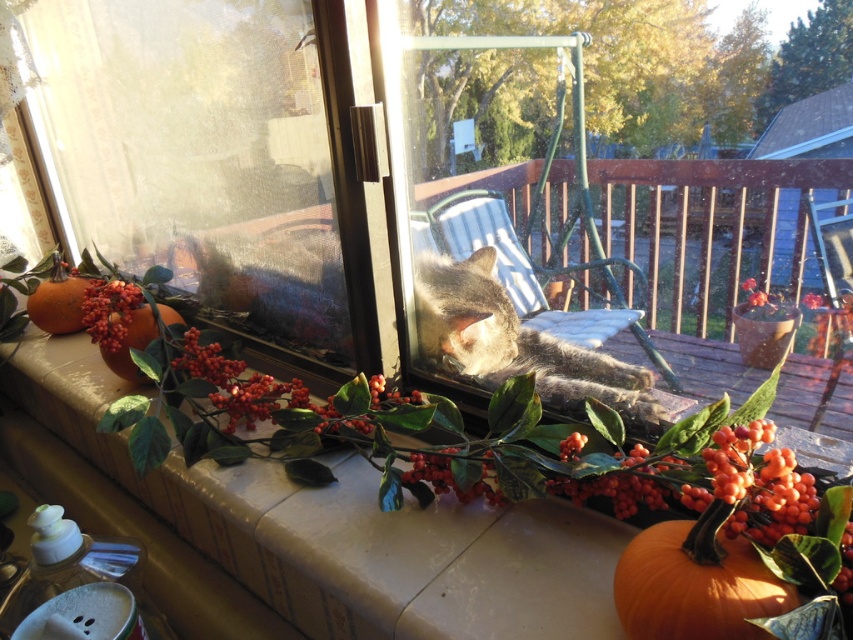
How far apart are smooth stone window sill at lower center and matte orange pumpkin at left?

A distance of 67.83 centimeters exists between smooth stone window sill at lower center and matte orange pumpkin at left.

Measure the distance between point (795, 596) and camera.

Point (795, 596) is 21.23 inches from camera.

This screenshot has height=640, width=853. In order to click on smooth stone window sill at lower center in this screenshot , I will do `click(514, 477)`.

Does matte orange pumpkin at lower left have a larger size compared to orange matte pumpkin at left?

No, matte orange pumpkin at lower left is not bigger than orange matte pumpkin at left.

Image resolution: width=853 pixels, height=640 pixels. Describe the element at coordinates (695, 582) in the screenshot. I see `matte orange pumpkin at lower left` at that location.

Image resolution: width=853 pixels, height=640 pixels. In order to click on matte orange pumpkin at lower left in this screenshot , I will do `click(695, 582)`.

Which is more to the left, gray fur cat at center or orange matte pumpkin at left?

Positioned to the left is orange matte pumpkin at left.

Is gray fur cat at center to the right of orange matte pumpkin at left from the viewer's perspective?

Correct, you'll find gray fur cat at center to the right of orange matte pumpkin at left.

Who is more distant from viewer, (462, 292) or (93, 339)?

The point (93, 339) is behind.

Locate an element on the screen. gray fur cat at center is located at coordinates (514, 342).